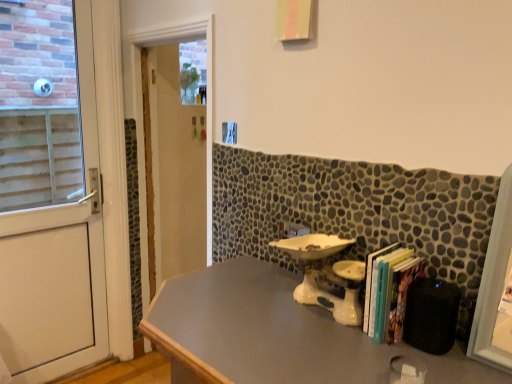
This screenshot has width=512, height=384. I want to click on free space in front of white ceramic sink at center, so click(x=330, y=351).